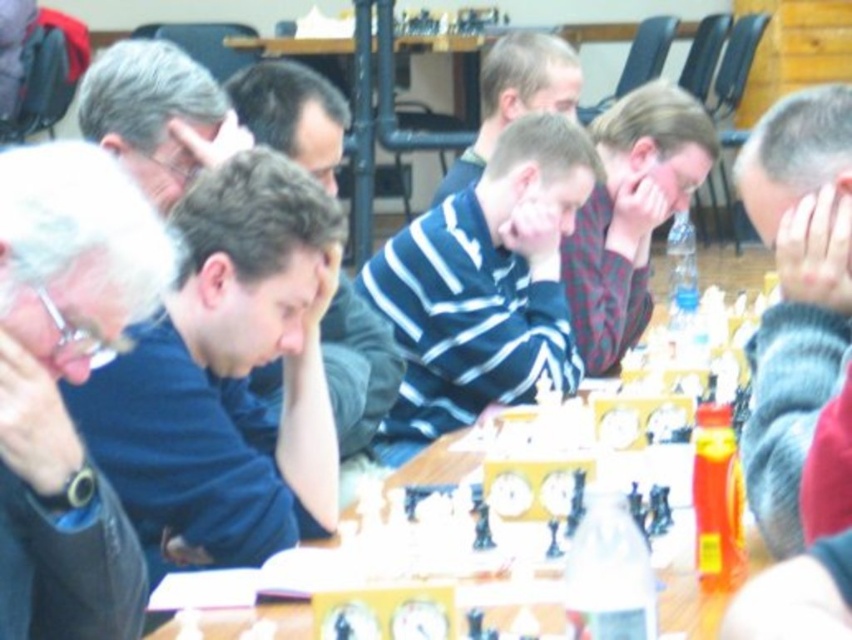
Does striped cotton shirt at center have a smaller size compared to gray knitted sweater at right?

No.

Is point (463, 396) closer to viewer compared to point (770, 109)?

That is True.

Between point (537, 353) and point (832, 257), which one is positioned behind?

The point (537, 353) is more distant.

This screenshot has height=640, width=852. Identify the location of striped cotton shirt at center. (482, 285).

Between point (447, 269) and point (286, 621), which one is positioned in front?

Point (286, 621) is in front.

Who is higher up, striped cotton shirt at center or wooden at center?

striped cotton shirt at center is above.

Is point (574, 186) in front of point (455, 440)?

No, it is not.

Find the location of a particular element. This screenshot has height=640, width=852. striped cotton shirt at center is located at coordinates (482, 285).

Find the location of a particular element. white fabric shirt at left is located at coordinates (68, 381).

Is point (67, 577) positioned in front of point (484, 88)?

Yes, point (67, 577) is closer to viewer.

Which is in front, point (43, 349) or point (499, 128)?

Point (43, 349) is in front.

This screenshot has height=640, width=852. Find the location of `white fabric shirt at left`. white fabric shirt at left is located at coordinates pyautogui.click(x=68, y=381).